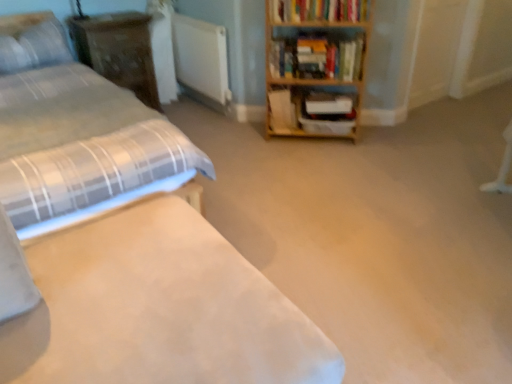
This screenshot has width=512, height=384. Describe the element at coordinates (281, 110) in the screenshot. I see `wooden bookshelf at center, which is the first book from bottom to top` at that location.

Identify the location of wooden bookshelf at center, which is the third book from top to bottom. The width and height of the screenshot is (512, 384). (281, 110).

What do you see at coordinates (118, 50) in the screenshot? I see `wooden dresser at upper left` at bounding box center [118, 50].

The height and width of the screenshot is (384, 512). Identify the location of hardcover book at upper right, which is the third book in bottom-to-top order. (318, 10).

This screenshot has width=512, height=384. What do you see at coordinates (318, 10) in the screenshot? I see `hardcover book at upper right, which is the third book in bottom-to-top order` at bounding box center [318, 10].

Describe the element at coordinates (127, 251) in the screenshot. I see `white fabric bed at left, the 2th bed from the back` at that location.

At what (x,y) coordinates should I click in order to perform the action: click on wooden bookshelf at center, which is the third book from top to bottom. Please return your answer as a coordinate pair (x, y). The width and height of the screenshot is (512, 384). Looking at the image, I should click on (281, 110).

Is wooden dresser at upper left not inside wooden shelf at center?

Indeed, wooden dresser at upper left is completely outside wooden shelf at center.

Consider the image. Which of these two, wooden dresser at upper left or wooden shelf at center, is wider?

With larger width is wooden dresser at upper left.

Is the surface of wooden dresser at upper left in direct contact with wooden shelf at center?

There is a gap between wooden dresser at upper left and wooden shelf at center.

Is wooden dresser at upper left shorter than wooden shelf at center?

No.

Is wooden shelf at center looking in the opposite direction of hardcover book at upper right, which is the third book in bottom-to-top order?

No.

Considering the sizes of wooden shelf at center and hardcover book at upper right, which is the third book in bottom-to-top order, in the image, is wooden shelf at center bigger or smaller than hardcover book at upper right, which is the third book in bottom-to-top order,?

Clearly, wooden shelf at center is larger in size than hardcover book at upper right, which is the third book in bottom-to-top order.

Is point (287, 119) positioned before point (315, 14)?

No, (287, 119) is behind (315, 14).

Considering the sizes of white textured pillow at upper left and wooden bookshelf at upper right, the second book in the top-to-bottom sequence, in the image, is white textured pillow at upper left taller or shorter than wooden bookshelf at upper right, the second book in the top-to-bottom sequence,?

Clearly, white textured pillow at upper left is shorter compared to wooden bookshelf at upper right, the second book in the top-to-bottom sequence.

Does point (57, 37) appear closer or farther from the camera than point (272, 71)?

Point (57, 37) is positioned farther from the camera compared to point (272, 71).

Is the depth of white textured pillow at upper left less than that of wooden bookshelf at upper right, the second book in the top-to-bottom sequence?

Yes.

Could you measure the distance between white textured pillow at upper left and wooden bookshelf at upper right, the second book in the top-to-bottom sequence?

They are 5.72 feet apart.

From the picture: From the image's perspective, is wooden bookshelf at center, which is the first book from bottom to top, above white fabric bed at left, the 2th bed from the back?

Yes, from the image's perspective, wooden bookshelf at center, which is the first book from bottom to top, is over white fabric bed at left, the 2th bed from the back.

Is wooden bookshelf at center, which is the third book from top to bottom, in front of or behind white fabric bed at left, the 1th bed when ordered from front to back, in the image?

wooden bookshelf at center, which is the third book from top to bottom, is behind white fabric bed at left, the 1th bed when ordered from front to back.

Does wooden bookshelf at center, which is the first book from bottom to top, have a greater height compared to white fabric bed at left, the 2th bed from the back?

No.

The height and width of the screenshot is (384, 512). Identify the location of the 1st book positioned above the white fabric bed at left, the 1th bed when ordered from front to back (from the image's perspective). (281, 110).

Where is `dresser located below the white matte radiator at center (from the image's perspective)`? This screenshot has height=384, width=512. dresser located below the white matte radiator at center (from the image's perspective) is located at coordinates (118, 50).

From the picture: Does white matte radiator at center have a larger size compared to wooden dresser at upper left?

Actually, white matte radiator at center might be smaller than wooden dresser at upper left.

From a real-world perspective, who is located lower, white matte radiator at center or wooden dresser at upper left?

wooden dresser at upper left, from a real-world perspective.

Considering the sizes of white fabric bed at left, arranged as the second bed when viewed from the front, and wooden bookshelf at center, which is the first book from bottom to top, in the image, is white fabric bed at left, arranged as the second bed when viewed from the front, wider or thinner than wooden bookshelf at center, which is the first book from bottom to top,?

In the image, white fabric bed at left, arranged as the second bed when viewed from the front, appears to be wider than wooden bookshelf at center, which is the first book from bottom to top.

Is white fabric bed at left, arranged as the second bed when viewed from the front, smaller than wooden bookshelf at center, which is the first book from bottom to top?

No.

From a real-world perspective, who is located higher, white fabric bed at left, marked as the first bed in a back-to-front arrangement, or wooden bookshelf at center, which is the first book from bottom to top?

In real-world perspective, white fabric bed at left, marked as the first bed in a back-to-front arrangement, is above.

What's the angular difference between wooden bookcase at upper right and wooden bookshelf at upper right, the 2th book positioned from the bottom,'s facing directions?

0.805 degrees separate the facing orientations of wooden bookcase at upper right and wooden bookshelf at upper right, the 2th book positioned from the bottom.

Looking at their sizes, would you say wooden bookcase at upper right is wider or thinner than wooden bookshelf at upper right, the second book in the top-to-bottom sequence?

Clearly, wooden bookcase at upper right has more width compared to wooden bookshelf at upper right, the second book in the top-to-bottom sequence.

From a real-world perspective, who is located lower, wooden bookcase at upper right or wooden bookshelf at upper right, the 2th book positioned from the bottom?

wooden bookcase at upper right is physically lower.

Is wooden bookshelf at upper right, the second book in the top-to-bottom sequence, at the back of wooden bookcase at upper right?

Yes, wooden bookcase at upper right's orientation is away from wooden bookshelf at upper right, the second book in the top-to-bottom sequence.

Where is `shelf lying in front of the wooden dresser at upper left`? Image resolution: width=512 pixels, height=384 pixels. shelf lying in front of the wooden dresser at upper left is located at coordinates (311, 110).

In the image, there is a hardcover book at upper right, which ranks as the 1th book in top-to-bottom order. Where is `shelf below it (from the image's perspective)`? This screenshot has width=512, height=384. shelf below it (from the image's perspective) is located at coordinates (311, 110).

Considering their positions, is white textured pillow at upper left positioned closer to wooden dresser at upper left than wooden bookshelf at center, which is the first book from bottom to top?

white textured pillow at upper left is closer to wooden dresser at upper left.

Considering their positions, is white textured pillow at upper left positioned further to wooden bookcase at upper right than wooden bookshelf at upper right, the 2th book positioned from the bottom?

Based on the image, white textured pillow at upper left appears to be further to wooden bookcase at upper right.

Estimate the real-world distances between objects in this image. Which object is closer to hardcover book at upper right, which ranks as the 1th book in top-to-bottom order, white textured pillow at upper left or wooden shelf at center?

wooden shelf at center is closer to hardcover book at upper right, which ranks as the 1th book in top-to-bottom order.

Considering their positions, is hardcover book at upper right, which ranks as the 1th book in top-to-bottom order, positioned closer to wooden shelf at center than wooden bookcase at upper right?

wooden bookcase at upper right is positioned closer to the anchor wooden shelf at center.

Which object lies nearer to the anchor point wooden shelf at center, white matte radiator at center or wooden bookcase at upper right?

wooden bookcase at upper right.

Looking at the image, which one is located further to wooden bookshelf at upper right, the second book in the top-to-bottom sequence, hardcover book at upper right, which ranks as the 1th book in top-to-bottom order, or white matte radiator at center?

white matte radiator at center is positioned further to the anchor wooden bookshelf at upper right, the second book in the top-to-bottom sequence.

Based on their spatial positions, is wooden bookcase at upper right or white fabric bed at left, arranged as the second bed when viewed from the front, closer to white textured pillow at upper left?

The object closer to white textured pillow at upper left is white fabric bed at left, arranged as the second bed when viewed from the front.

Considering their positions, is wooden dresser at upper left positioned further to wooden bookcase at upper right than wooden shelf at center?

Among the two, wooden dresser at upper left is located further to wooden bookcase at upper right.

Find the location of a particular element. This screenshot has width=512, height=384. dresser positioned between white fabric bed at left, marked as the first bed in a back-to-front arrangement, and white matte radiator at center from near to far is located at coordinates (118, 50).

In order to click on shelf between white fabric bed at left, arranged as the second bed when viewed from the front, and wooden dresser at upper left from front to back in this screenshot , I will do `click(311, 110)`.

Identify the location of shelf positioned between white fabric bed at left, the 2th bed from the back, and white matte radiator at center from near to far. (311, 110).

Find the location of `bookcase located between wooden dresser at upper left and wooden shelf at center in the left-right direction`. bookcase located between wooden dresser at upper left and wooden shelf at center in the left-right direction is located at coordinates (315, 62).